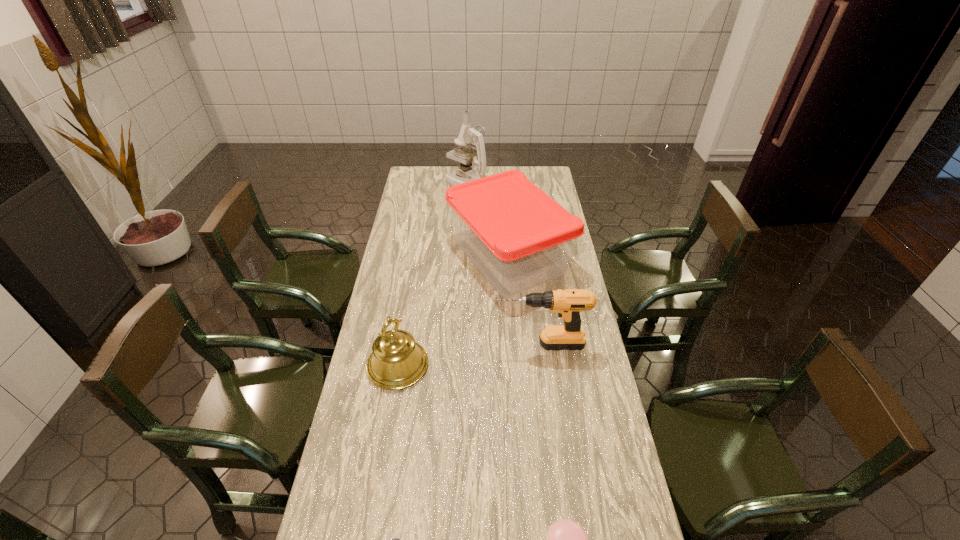
Find the location of a particular element. the tallest object is located at coordinates (467, 136).

This screenshot has height=540, width=960. I want to click on microscope, so click(467, 136).

The height and width of the screenshot is (540, 960). Identify the location of the fifth nearest object. (518, 237).

At what (x,y) coordinates should I click in order to perform the action: click on drill. Please return your answer as a coordinate pair (x, y). This screenshot has width=960, height=540. Looking at the image, I should click on (568, 303).

Where is `bell`? bell is located at coordinates (396, 362).

You are a GUI agent. You are given a task and a screenshot of the screen. Output one action in this format:
    pyautogui.click(x=<x>, y=<y>)
    Task: Click on the vacant space located on the front of the tallest object
    The height and width of the screenshot is (540, 960).
    Given the screenshot: What is the action you would take?
    pyautogui.click(x=466, y=237)

Locate an element on the screen. free spot located on the left of the fifth nearest object is located at coordinates (397, 258).

This screenshot has width=960, height=540. I want to click on free location located 0.390m at the tip of the drill, so point(382,345).

You are a GUI agent. You are given a task and a screenshot of the screen. Output one action in this format:
    pyautogui.click(x=<x>, y=<y>)
    Task: Click on the free space located at the tip of the drill
    This screenshot has height=540, width=960.
    Given the screenshot: What is the action you would take?
    pyautogui.click(x=416, y=345)

Locate an element on the screen. vacant space located 0.370m at the tip of the drill is located at coordinates (388, 345).